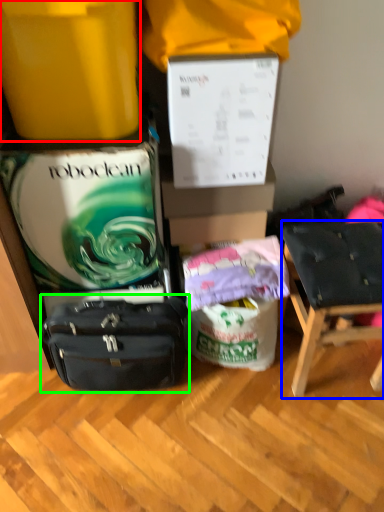
Question: Estimate the real-world distances between objects in this image. Which object is closer to box (highlighted by a red box), chair (highlighted by a blue box) or luggage and bags (highlighted by a green box)?

Choices:
 (A) chair
 (B) luggage and bags

Answer: (B)